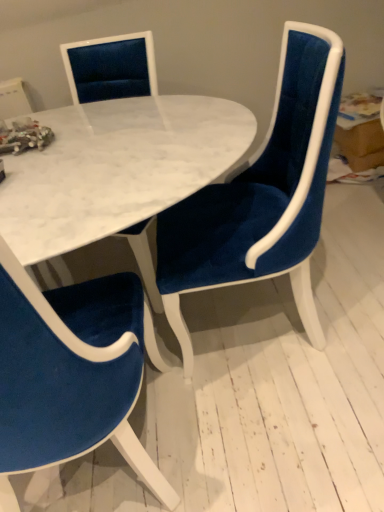
Question: Does velvet blue chair at center, the 2th chair from the left, have a larger size compared to velvet blue chair at lower left, positioned as the second chair in right-to-left order?

Choices:
 (A) no
 (B) yes

Answer: (A)

Question: Does velvet blue chair at center, the 2th chair from the left, have a greater height compared to velvet blue chair at lower left, positioned as the second chair in right-to-left order?

Choices:
 (A) no
 (B) yes

Answer: (A)

Question: Is velvet blue chair at center, the 2th chair from the left, in contact with velvet blue chair at lower left, placed as the 1th chair when sorted from left to right?

Choices:
 (A) yes
 (B) no

Answer: (B)

Question: From a real-world perspective, is velvet blue chair at center, the 2th chair from the left, on velvet blue chair at lower left, positioned as the second chair in right-to-left order?

Choices:
 (A) no
 (B) yes

Answer: (A)

Question: Would you say velvet blue chair at center, the 2th chair from the left, is a long distance from velvet blue chair at lower left, placed as the 1th chair when sorted from left to right?

Choices:
 (A) yes
 (B) no

Answer: (B)

Question: Is velvet blue chair at center, the 1th chair viewed from the right, looking in the opposite direction of velvet blue chair at lower left, placed as the 1th chair when sorted from left to right?

Choices:
 (A) yes
 (B) no

Answer: (B)

Question: Can you confirm if velvet blue chair at lower left, positioned as the second chair in right-to-left order, is bigger than velvet blue chair at center, the 1th chair viewed from the right?

Choices:
 (A) no
 (B) yes

Answer: (B)

Question: Is velvet blue chair at center, the 1th chair viewed from the right, inside velvet blue chair at lower left, positioned as the second chair in right-to-left order?

Choices:
 (A) yes
 (B) no

Answer: (B)

Question: From a real-world perspective, is velvet blue chair at lower left, placed as the 1th chair when sorted from left to right, over velvet blue chair at center, the 2th chair from the left?

Choices:
 (A) no
 (B) yes

Answer: (B)

Question: Does velvet blue chair at lower left, positioned as the second chair in right-to-left order, turn towards velvet blue chair at center, the 2th chair from the left?

Choices:
 (A) no
 (B) yes

Answer: (A)

Question: Can you confirm if velvet blue chair at lower left, positioned as the second chair in right-to-left order, is shorter than velvet blue chair at center, the 1th chair viewed from the right?

Choices:
 (A) no
 (B) yes

Answer: (A)

Question: Is velvet blue chair at lower left, placed as the 1th chair when sorted from left to right, positioned beyond the bounds of velvet blue chair at center, the 2th chair from the left?

Choices:
 (A) yes
 (B) no

Answer: (A)

Question: Is white marble table at center surrounded by velvet blue chair at lower left, positioned as the second chair in right-to-left order?

Choices:
 (A) no
 (B) yes

Answer: (A)